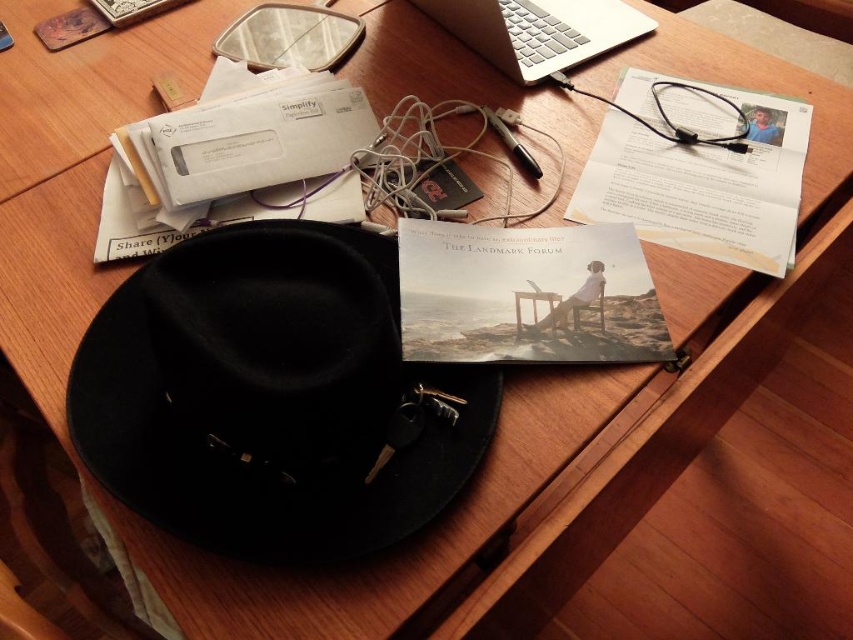
You are organizing the desk and need to place the white paper at upper right and the silver metallic laptop at upper center into a drawer. Which object should you place first if you want to maximize the drawer space?

The white paper at upper right has a larger size compared to the silver metallic laptop at upper center, so you should place the white paper at upper right first to maximize the drawer space.

Please provide the coordinates of the black felt fedora at lower left in the image.

The black felt fedora at lower left is located at coordinates point (273, 396).